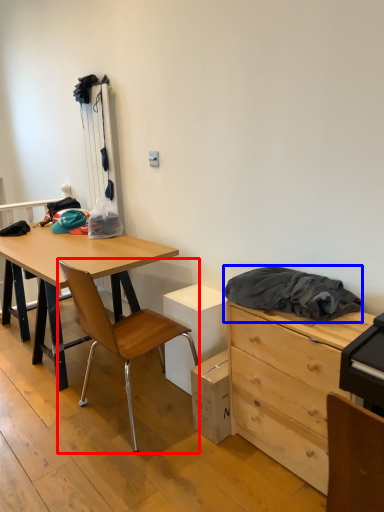
Question: Among these objects, which one is farthest to the camera, chair (highlighted by a red box) or clothing (highlighted by a blue box)?

Choices:
 (A) chair
 (B) clothing

Answer: (A)